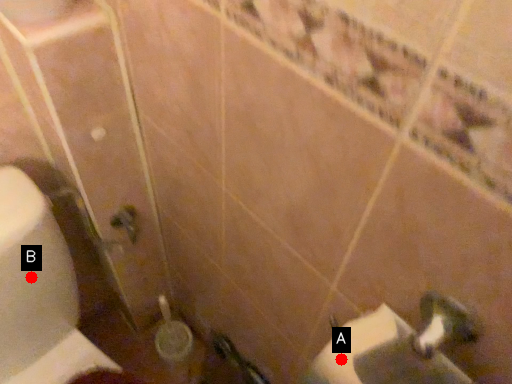
Question: Two points are circled on the image, labeled by A and B beside each circle. Which point is closer to the camera?

Choices:
 (A) A is closer
 (B) B is closer

Answer: (A)